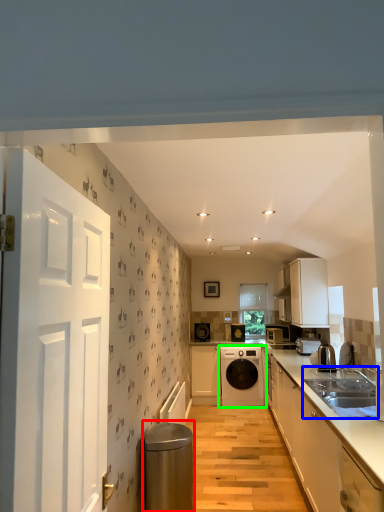
Question: Based on their relative distances, which object is nearer to water heater (highlighted by a red box)? Choose from sink (highlighted by a blue box) and home appliance (highlighted by a green box).

Choices:
 (A) sink
 (B) home appliance

Answer: (A)